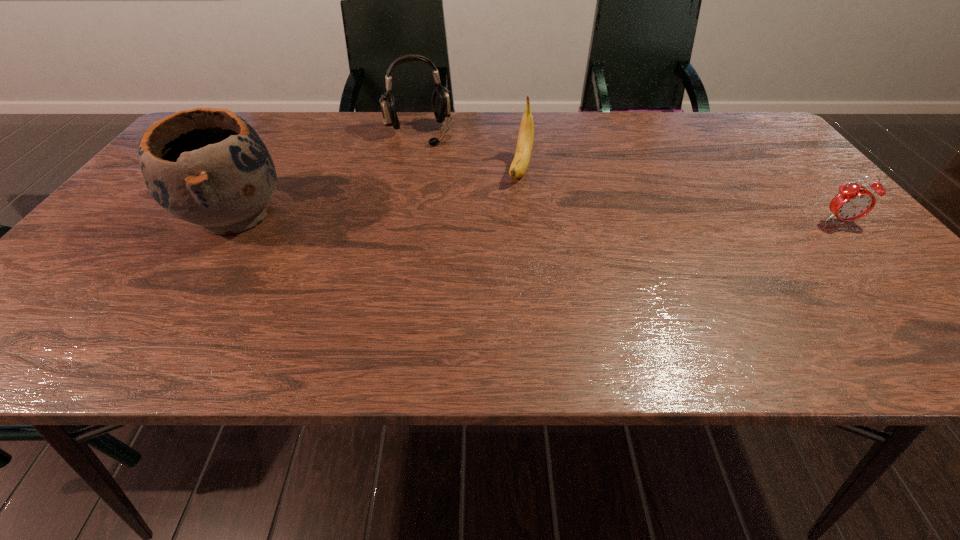
Where is `free space on the desktop that is between the pottery and the shortest object and is positioned at the start of the peel on the third tallest object`? free space on the desktop that is between the pottery and the shortest object and is positioned at the start of the peel on the third tallest object is located at coordinates (503, 218).

At what (x,y) coordinates should I click in order to perform the action: click on free spot on the desktop that is between the pottery and the rightmost object and is positioned with the microphone on the side of the third object from right to left. Please return your answer as a coordinate pair (x, y). The width and height of the screenshot is (960, 540). Looking at the image, I should click on (460, 218).